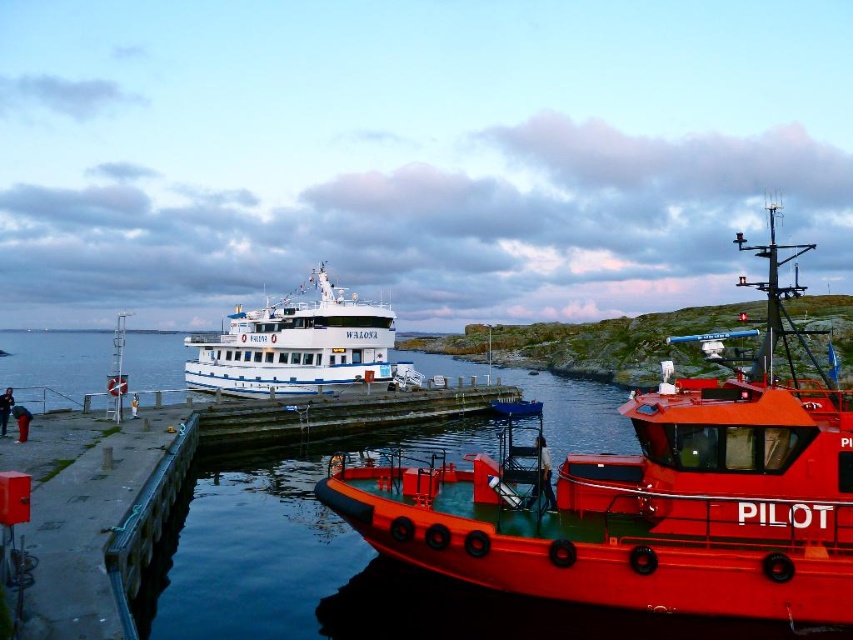
Question: Which object is farther from the camera taking this photo?

Choices:
 (A) white matte ferry at center
 (B) rubberized red pilot boat at right

Answer: (A)

Question: Is rubberized red pilot boat at right bigger than white matte ferry at center?

Choices:
 (A) no
 (B) yes

Answer: (B)

Question: Which point is closer to the camera?

Choices:
 (A) (659, 522)
 (B) (253, 369)

Answer: (A)

Question: Where is rubberized red pilot boat at right located in relation to white matte ferry at center in the image?

Choices:
 (A) above
 (B) below

Answer: (B)

Question: Does rubberized red pilot boat at right have a larger size compared to white matte ferry at center?

Choices:
 (A) no
 (B) yes

Answer: (B)

Question: Which of the following is the closest to the observer?

Choices:
 (A) (474, 561)
 (B) (381, 355)

Answer: (A)